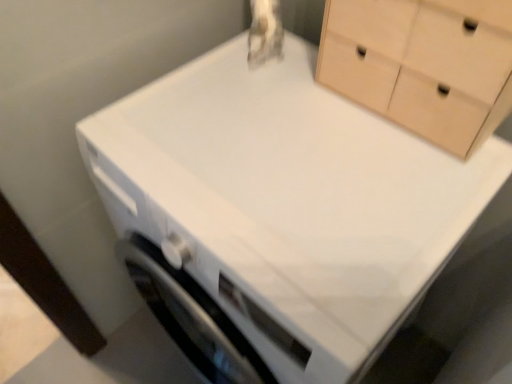
The height and width of the screenshot is (384, 512). I want to click on vacant space that is to the left of matte cardboard chest of drawers at upper right, so click(283, 117).